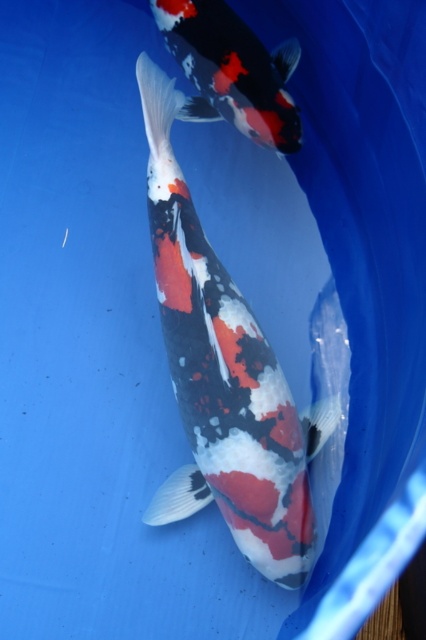
Which of these two, speckled white and black fish at center or speckled white and black fish at upper center, stands shorter?

speckled white and black fish at upper center is shorter.

Is point (242, 406) less distant than point (221, 118)?

Yes, it is.

Locate an element on the screen. The height and width of the screenshot is (640, 426). speckled white and black fish at center is located at coordinates (224, 378).